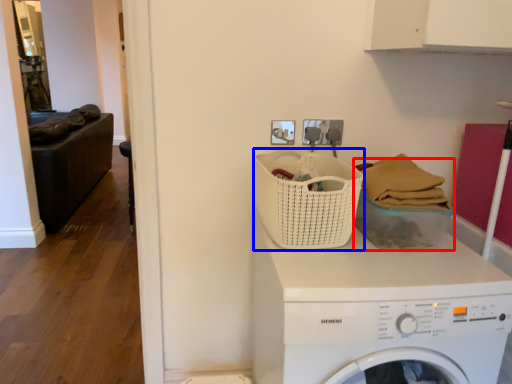
Question: Among these objects, which one is farthest to the camera, basket (highlighted by a red box) or basket (highlighted by a blue box)?

Choices:
 (A) basket
 (B) basket

Answer: (A)